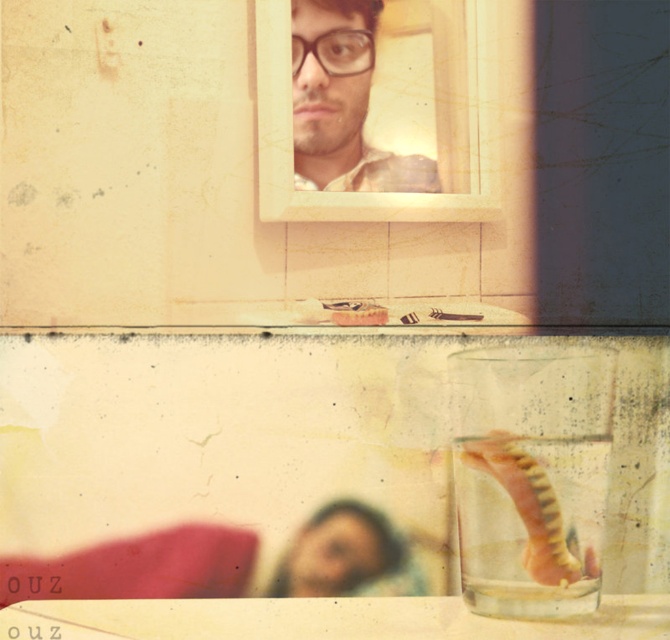
Question: Can you confirm if smooth skin selfie at lower center is smaller than blurred skin at lower center?

Choices:
 (A) yes
 (B) no

Answer: (B)

Question: Can you confirm if smooth skin selfie at lower center is thinner than blurred skin at lower center?

Choices:
 (A) yes
 (B) no

Answer: (B)

Question: Among these points, which one is nearest to the camera?

Choices:
 (A) (151, 547)
 (B) (366, 534)
 (C) (297, 10)

Answer: (A)

Question: Is smooth skin selfie at lower center to the right of matte plastic selfie at upper center from the viewer's perspective?

Choices:
 (A) no
 (B) yes

Answer: (A)

Question: Which object is farther from the camera taking this photo?

Choices:
 (A) smooth skin selfie at lower center
 (B) matte plastic selfie at upper center
 (C) blurred skin at lower center

Answer: (B)

Question: Among these objects, which one is nearest to the camera?

Choices:
 (A) smooth skin selfie at lower center
 (B) matte plastic selfie at upper center

Answer: (A)